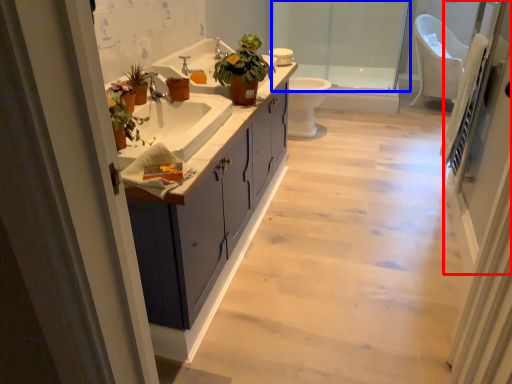
Question: Which object is further to the camera taking this photo, screen door (highlighted by a red box) or shower door (highlighted by a blue box)?

Choices:
 (A) screen door
 (B) shower door

Answer: (B)